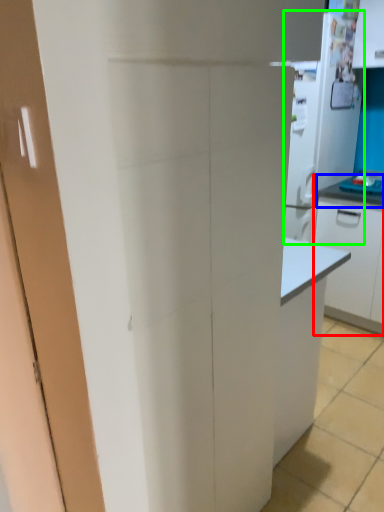
Question: Which is farther away from cabinetry (highlighted by a red box)? countertop (highlighted by a blue box) or appliance (highlighted by a green box)?

Choices:
 (A) countertop
 (B) appliance

Answer: (B)